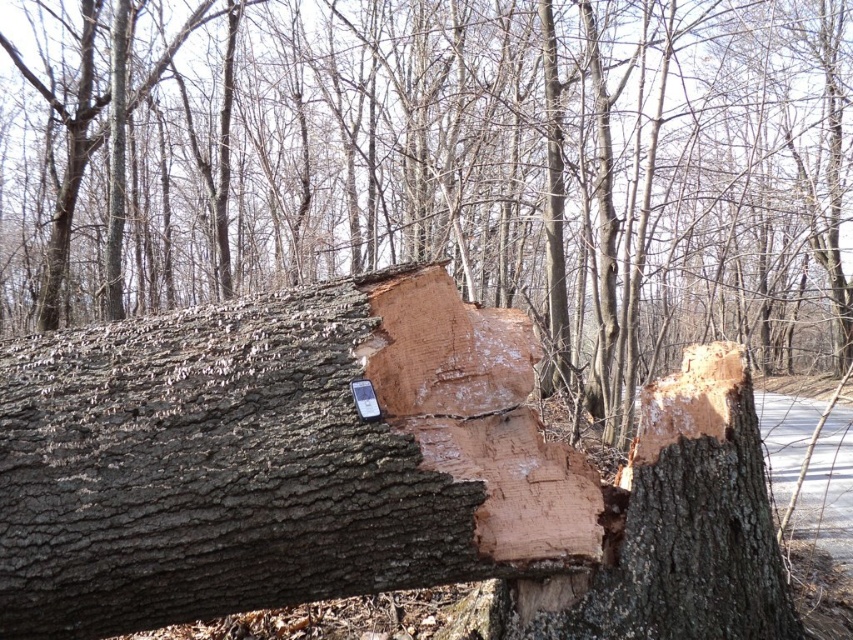
You are a hiker who has found a split tree trunk in the woods. You have a smooth brown log at center and a light brown wood at center. Which part of the tree trunk is on the left side?

The smooth brown log at center is positioned on the left side of light brown wood at center.

You are a hiker carrying a 5 meter long rope. You want to secure your gear between the smooth brown log at center and the light brown wood at center. Can you tie the rope between them without any slack?

The distance between the smooth brown log at center and the light brown wood at center is 4.91 meters. Since the rope is 5 meters long, there will be enough slack to tie it between them.